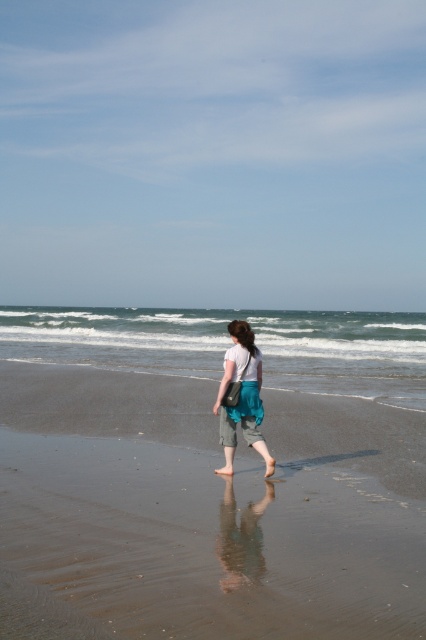
You are standing at the edge of the beach and want to place a small seashell exactly where the brown sand at lower center is located. According to the coordinates provided, where should you place the seashell?

The brown sand at lower center is located at point [209,509], so you should place the seashell at those coordinates.

You are standing on the beach and want to place a small seashell exactly where the brown sand at lower center is located. According to the coordinates provided, where should you place the seashell?

You should place the seashell at point coordinates (209,509) where the brown sand at lower center is located.